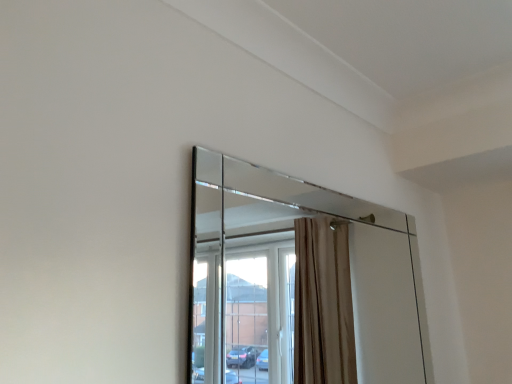
I want to click on clear glass mirror at upper center, so click(297, 280).

What do you see at coordinates (297, 280) in the screenshot? I see `clear glass mirror at upper center` at bounding box center [297, 280].

Image resolution: width=512 pixels, height=384 pixels. In order to click on clear glass mirror at upper center in this screenshot , I will do 297,280.